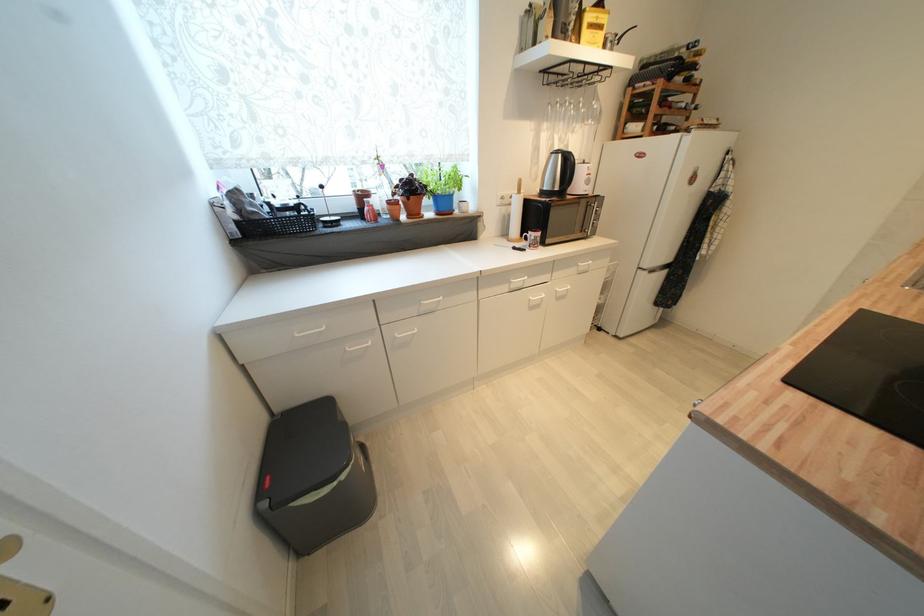
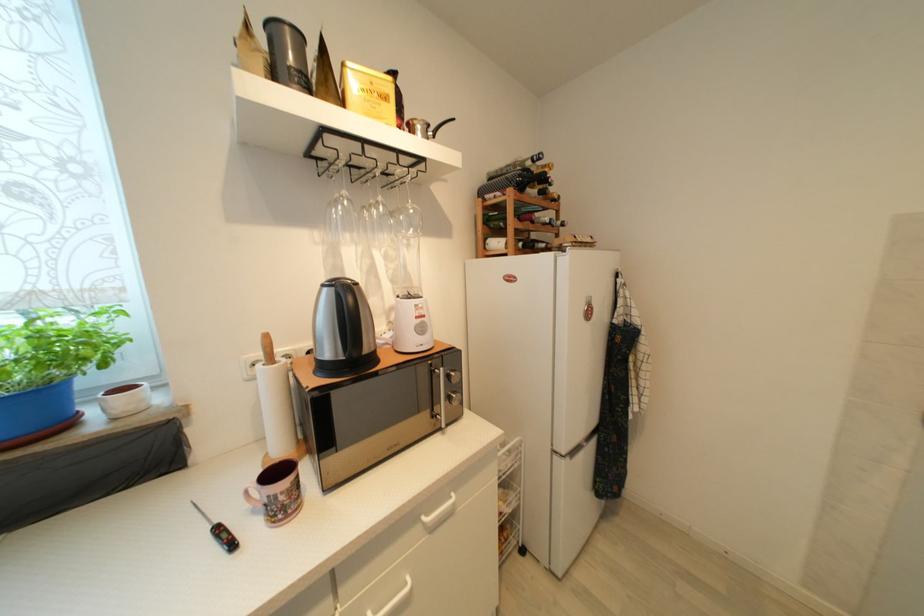
Where in the second image is the point corresponding to (x=681, y=132) from the first image?

(553, 251)